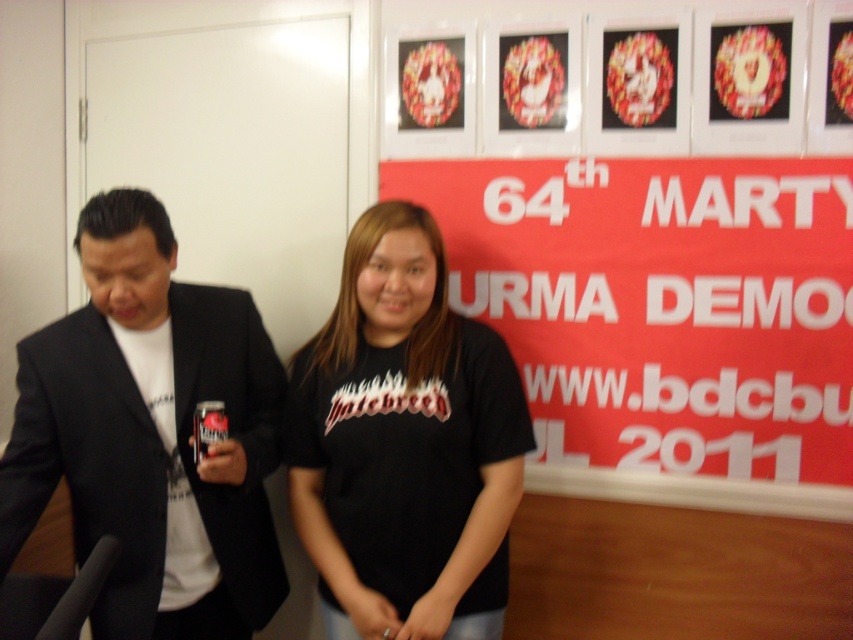
Based on the photo, please describe the location of the red matte poster at center in the image using the coordinate system where the bottom left corner is the origin point. The poster is located at coordinates...

The red matte poster at center is located at coordinates point (660, 304).

From the picture: Two people are standing in front of a red banner. The person on the left is holding a beverage can. The person on the right is wearing a black tshirt with the word InteBreed. There is a point at point [231,451]. How far apart are the two people?

The two people are 1.42 meters apart.